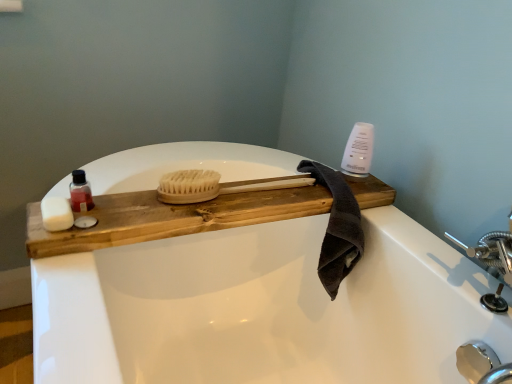
Find the location of a particular element. The width and height of the screenshot is (512, 384). vacant area that lies to the right of white matte soap at left, marked as the 2th soap in a left-to-right arrangement is located at coordinates (161, 207).